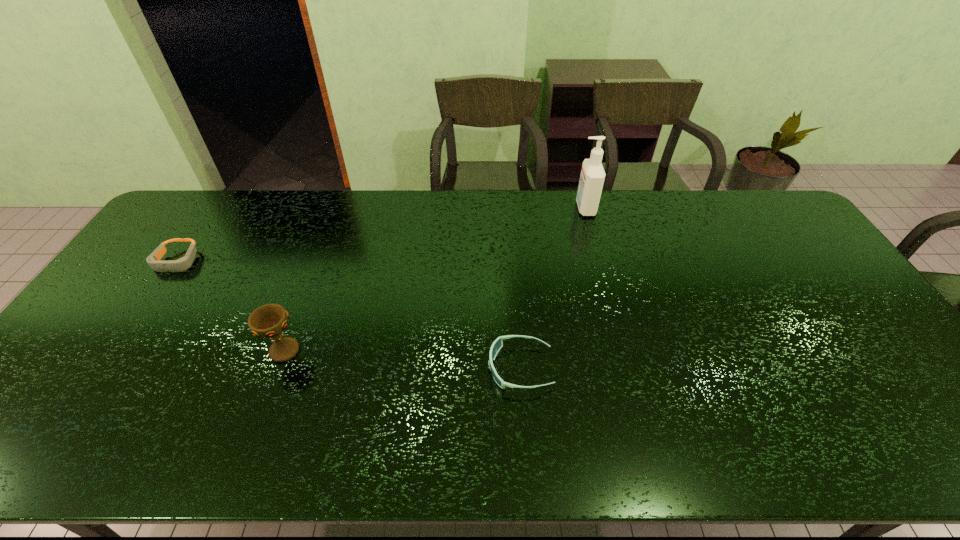
Find the location of a particular element. This screenshot has width=960, height=540. empty location between the cleansing agent and the chalice is located at coordinates (435, 279).

The width and height of the screenshot is (960, 540). Find the location of `free space between the farthest object and the right goggles`. free space between the farthest object and the right goggles is located at coordinates (553, 288).

The height and width of the screenshot is (540, 960). I want to click on free spot between the left goggles and the taller goggles, so click(348, 314).

Locate an element on the screen. free space between the left goggles and the chalice is located at coordinates (230, 306).

Identify the location of free space between the third tallest object and the farthest object. (553, 288).

Locate an element on the screen. vacant space in between the third nearest object and the third object from right to left is located at coordinates (230, 306).

In order to click on vacant region between the left goggles and the farthest object in this screenshot , I will do `click(381, 234)`.

This screenshot has height=540, width=960. I want to click on vacant area that lies between the second tallest object and the taller goggles, so click(402, 359).

Where is `free space between the rightmost object and the leftmost object`? Image resolution: width=960 pixels, height=540 pixels. free space between the rightmost object and the leftmost object is located at coordinates (381, 234).

In order to click on free space between the shorter goggles and the right goggles in this screenshot , I will do `click(348, 314)`.